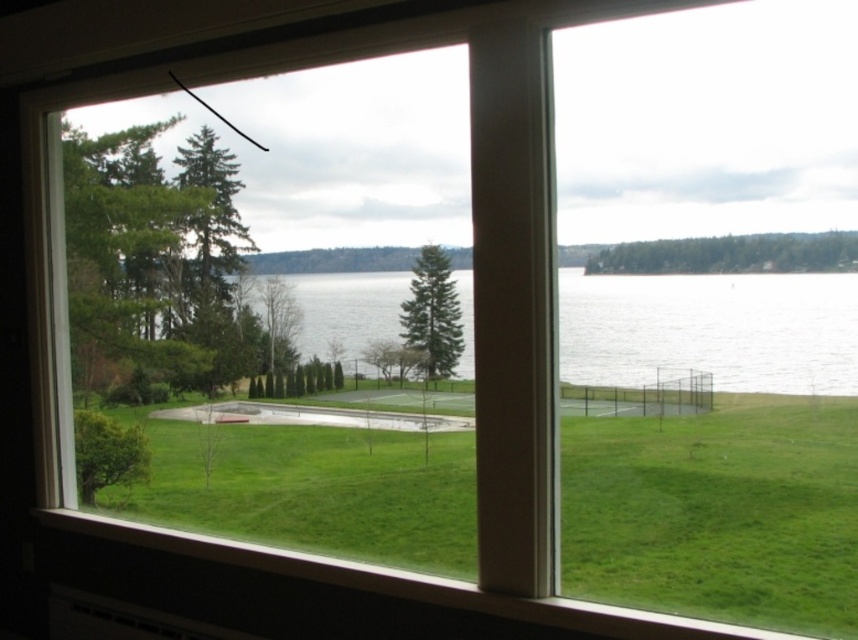
Who is taller, green grassy at lower left or clear water at center?

Standing taller between the two is clear water at center.

Who is shorter, green grassy at lower left or clear water at center?

green grassy at lower left is shorter.

This screenshot has height=640, width=858. What do you see at coordinates (717, 509) in the screenshot?
I see `green grassy at lower left` at bounding box center [717, 509].

Image resolution: width=858 pixels, height=640 pixels. What are the coordinates of `green grassy at lower left` in the screenshot? It's located at (717, 509).